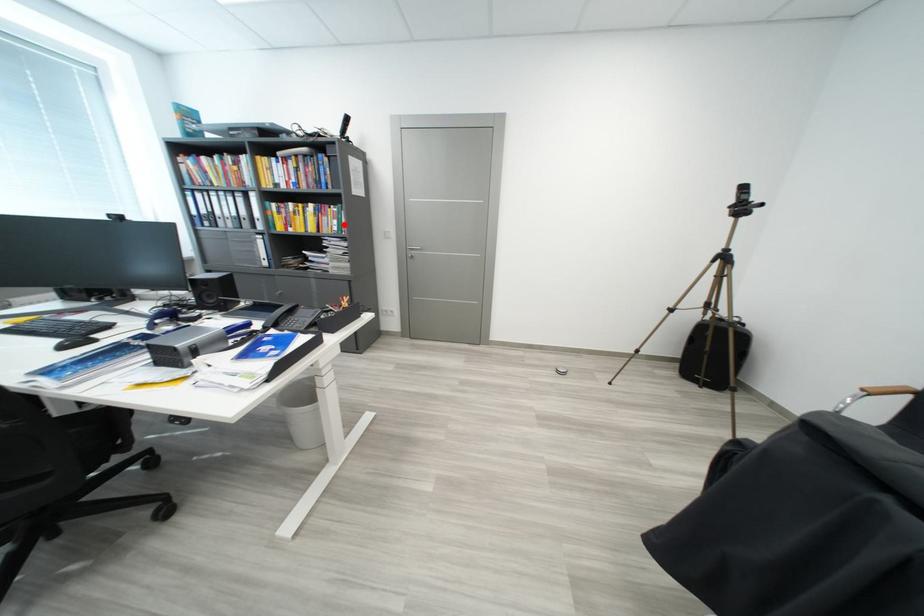
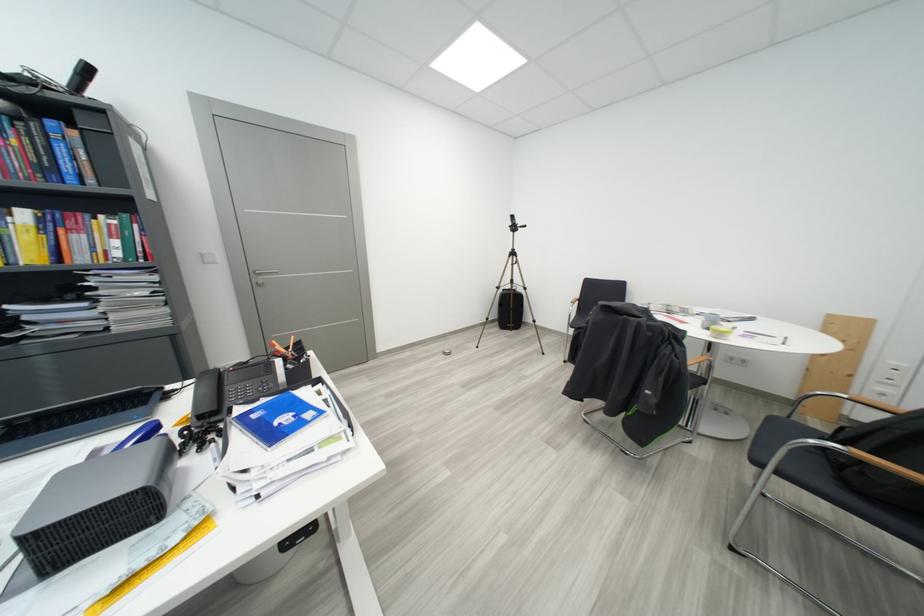
Question: A red point is marked in image1. In image2, is the corresponding 3D point closer to the camera or farther? Reply with the corresponding letter.

Choices:
 (A) The corresponding 3D point is closer.
 (B) The corresponding 3D point is farther.

Answer: (B)